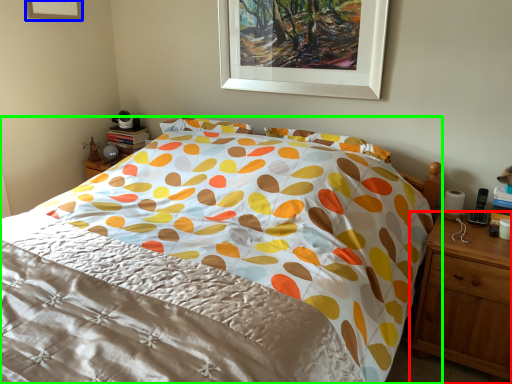
Question: Considering the real-world distances, which object is farthest from nightstand (highlighted by a red box)? picture frame (highlighted by a blue box) or bed (highlighted by a green box)?

Choices:
 (A) picture frame
 (B) bed

Answer: (A)